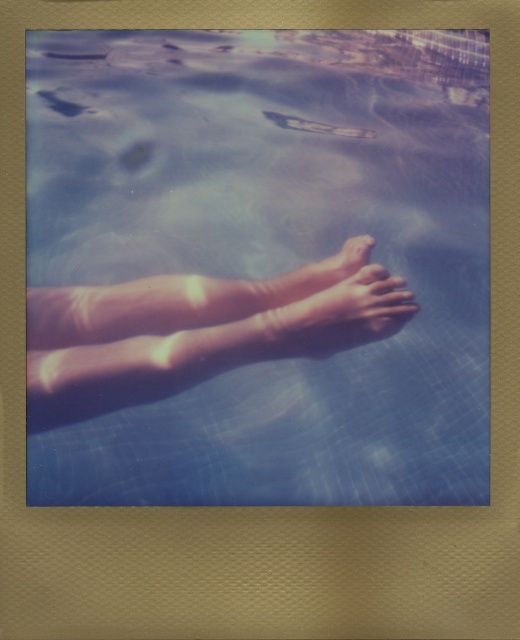
You are holding a Polaroid camera and want to take a photo of the transparent blue water at center. Where should you point your camera to capture it?

You should point your camera at point (256, 268) to capture the transparent blue water at center.

You are designing a pool filter system and need to know the relative widths of the transparent blue water at center and smooth skin feet at center. Which one is wider?

The transparent blue water at center is wider than smooth skin feet at center according to the description.